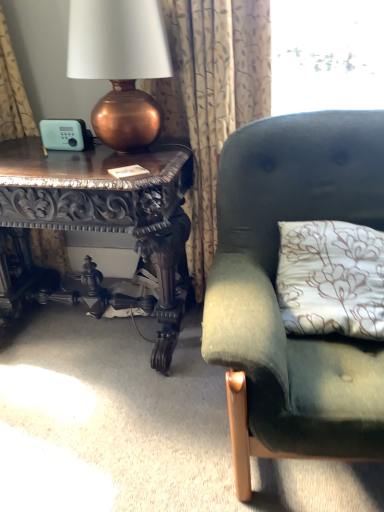
At what (x,y) coordinates should I click in order to perform the action: click on vacant space in front of copper metallic lamp at left. Please return your answer as a coordinate pair (x, y). The width and height of the screenshot is (384, 512). Looking at the image, I should click on (104, 169).